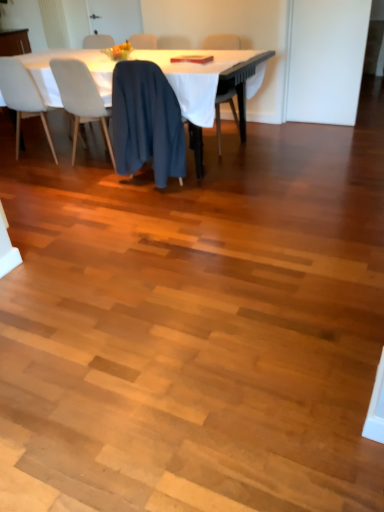
Question: Considering the relative positions of blue fabric chair at center, the 2th chair when ordered from left to right, and dark blue fabric at center, which is the second chair from right to left, in the image provided, is blue fabric chair at center, the 2th chair when ordered from left to right, to the left of dark blue fabric at center, which is the second chair from right to left, from the viewer's perspective?

Choices:
 (A) yes
 (B) no

Answer: (A)

Question: Can you confirm if blue fabric chair at center, the 2th chair when ordered from left to right, is thinner than dark blue fabric at center, placed as the third chair when sorted from left to right?

Choices:
 (A) yes
 (B) no

Answer: (B)

Question: Is blue fabric chair at center, the 2th chair when ordered from left to right, to the right of dark blue fabric at center, placed as the third chair when sorted from left to right, from the viewer's perspective?

Choices:
 (A) yes
 (B) no

Answer: (B)

Question: Is blue fabric chair at center, the 2th chair when ordered from left to right, positioned with its back to dark blue fabric at center, which is the second chair from right to left?

Choices:
 (A) yes
 (B) no

Answer: (B)

Question: Is blue fabric chair at center, the 2th chair when ordered from left to right, wider than dark blue fabric at center, placed as the third chair when sorted from left to right?

Choices:
 (A) no
 (B) yes

Answer: (B)

Question: Would you say matte black chair at center, the fourth chair from the left, is inside or outside white cloth-covered table at upper center?

Choices:
 (A) outside
 (B) inside

Answer: (B)

Question: From a real-world perspective, is matte black chair at center, the first chair viewed from the right, above or below white cloth-covered table at upper center?

Choices:
 (A) below
 (B) above

Answer: (B)

Question: In terms of width, does matte black chair at center, the fourth chair from the left, look wider or thinner when compared to white cloth-covered table at upper center?

Choices:
 (A) thin
 (B) wide

Answer: (A)

Question: In terms of height, does matte black chair at center, the first chair viewed from the right, look taller or shorter compared to white cloth-covered table at upper center?

Choices:
 (A) short
 (B) tall

Answer: (B)

Question: In terms of width, does blue fabric chair at center, the 2th chair when ordered from left to right, look wider or thinner when compared to dark blue fabric at center, which is the second chair from right to left?

Choices:
 (A) wide
 (B) thin

Answer: (A)

Question: From the image's perspective, is blue fabric chair at center, the 2th chair when ordered from left to right, positioned above or below dark blue fabric at center, which is the second chair from right to left?

Choices:
 (A) below
 (B) above

Answer: (B)

Question: Considering the positions of blue fabric chair at center, which is the third chair from right to left, and dark blue fabric at center, which is the second chair from right to left, in the image, is blue fabric chair at center, which is the third chair from right to left, taller or shorter than dark blue fabric at center, which is the second chair from right to left,?

Choices:
 (A) tall
 (B) short

Answer: (A)

Question: From a real-world perspective, is blue fabric chair at center, which is the third chair from right to left, physically located above or below dark blue fabric at center, placed as the third chair when sorted from left to right?

Choices:
 (A) above
 (B) below

Answer: (B)

Question: From a real-world perspective, is blue fabric chair at center, the 2th chair when ordered from left to right, positioned above or below white cloth-covered table at upper center?

Choices:
 (A) below
 (B) above

Answer: (B)

Question: Is blue fabric chair at center, which is the third chair from right to left, taller or shorter than white cloth-covered table at upper center?

Choices:
 (A) tall
 (B) short

Answer: (A)